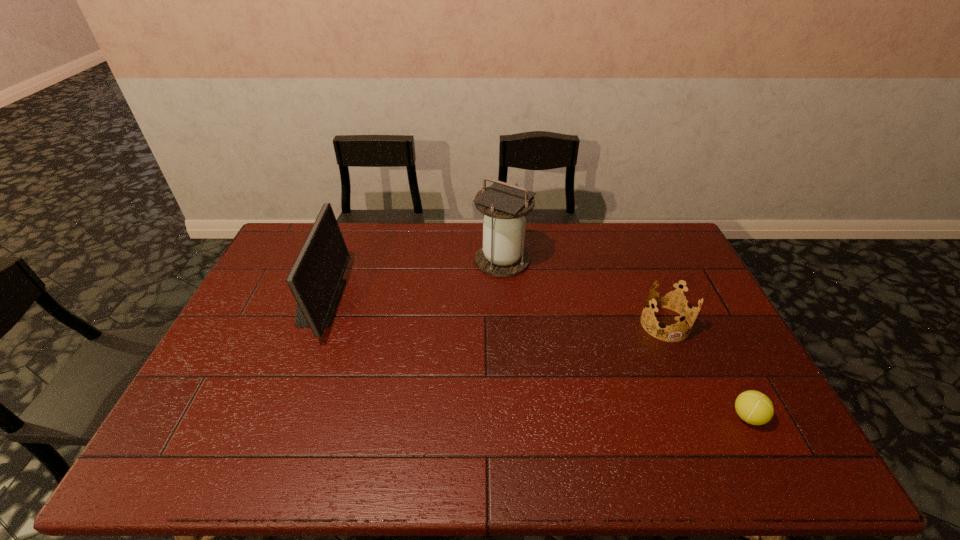
In order to click on vacant point that satisfies the following two spatial constraints: 1. on the screen side of the computer monitor; 2. on the back side of the shortest object in this screenshot , I will do `click(274, 417)`.

Find the location of `free region that satisfies the following two spatial constraints: 1. on the screen side of the shortest object; 2. on the right side of the computer monitor`. free region that satisfies the following two spatial constraints: 1. on the screen side of the shortest object; 2. on the right side of the computer monitor is located at coordinates (274, 417).